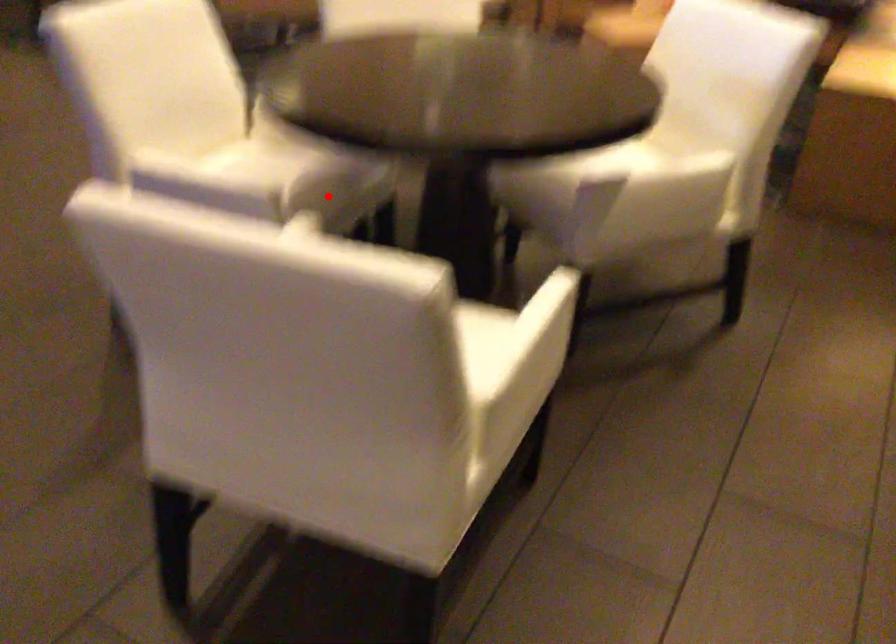
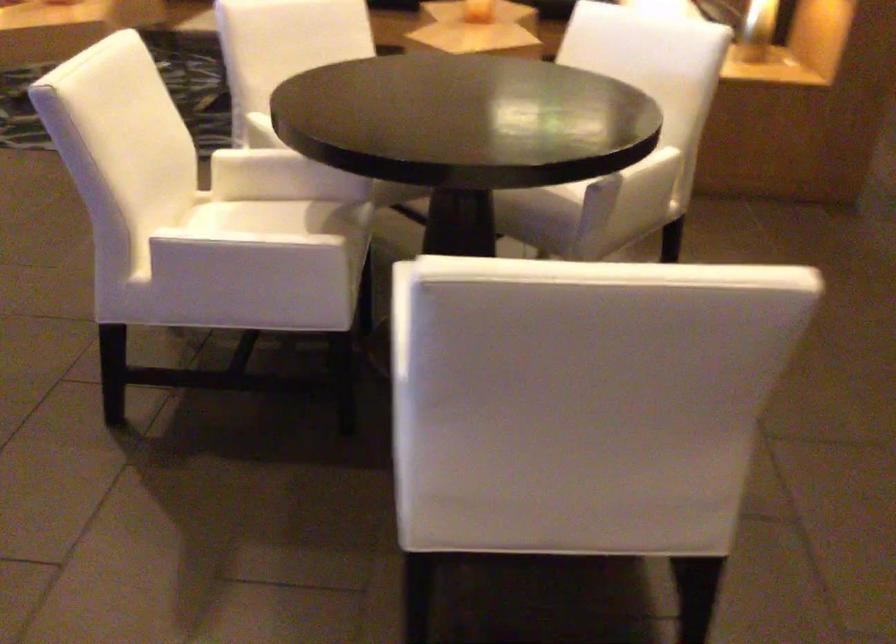
The point at the highlighted location is marked in the first image. Where is the corresponding point in the second image?

(347, 240)